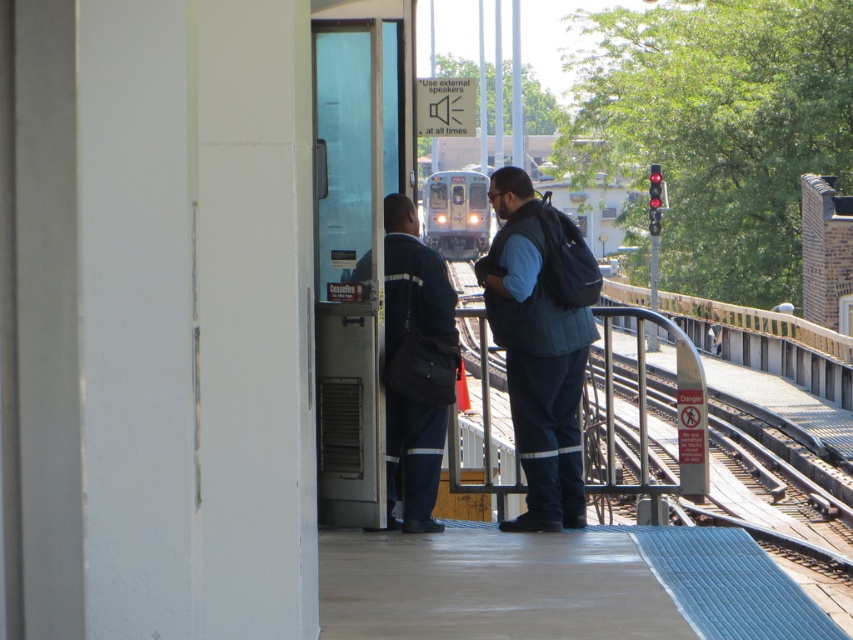
Who is lower down, dark blue uniform at center or silver metallic train at center?

Positioned lower is dark blue uniform at center.

Does dark blue uniform at center have a greater width compared to silver metallic train at center?

Yes, dark blue uniform at center is wider than silver metallic train at center.

Does point (424, 490) come farther from viewer compared to point (425, 241)?

That is False.

What are the coordinates of `dark blue uniform at center` in the screenshot? It's located at (415, 364).

Does dark blue quilted vest at center have a lesser width compared to silver metallic train at center?

In fact, dark blue quilted vest at center might be wider than silver metallic train at center.

Between dark blue quilted vest at center and silver metallic train at center, which one has less height?

silver metallic train at center is shorter.

Is point (579, 396) closer to viewer compared to point (454, 193)?

Yes, point (579, 396) is in front of point (454, 193).

Image resolution: width=853 pixels, height=640 pixels. What are the coordinates of `dark blue quilted vest at center` in the screenshot? It's located at (537, 353).

Is dark blue quilted vest at center positioned before dark blue uniform at center?

Yes, it is.

Between dark blue quilted vest at center and dark blue uniform at center, which one is positioned higher?

dark blue uniform at center is higher up.

Describe the element at coordinates (537, 353) in the screenshot. Image resolution: width=853 pixels, height=640 pixels. I see `dark blue quilted vest at center` at that location.

Where is `dark blue quilted vest at center`? dark blue quilted vest at center is located at coordinates (537, 353).